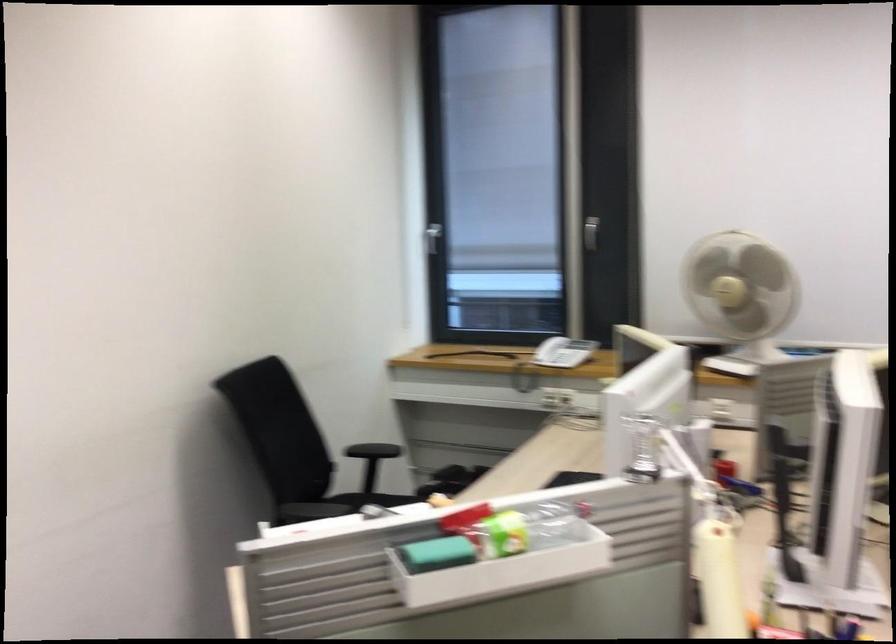
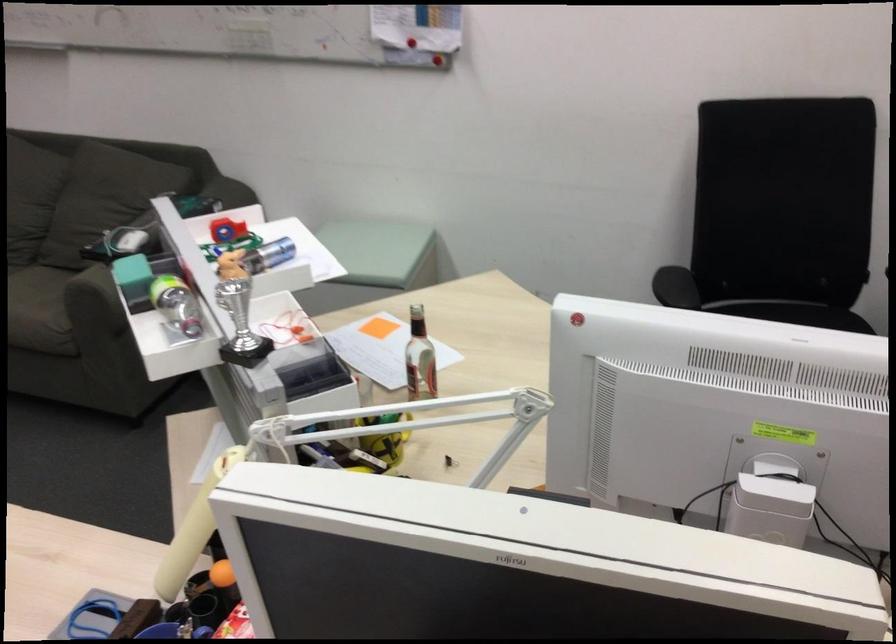
Where in the second image is the point corresponding to point 685,422 from the first image?

(770, 509)